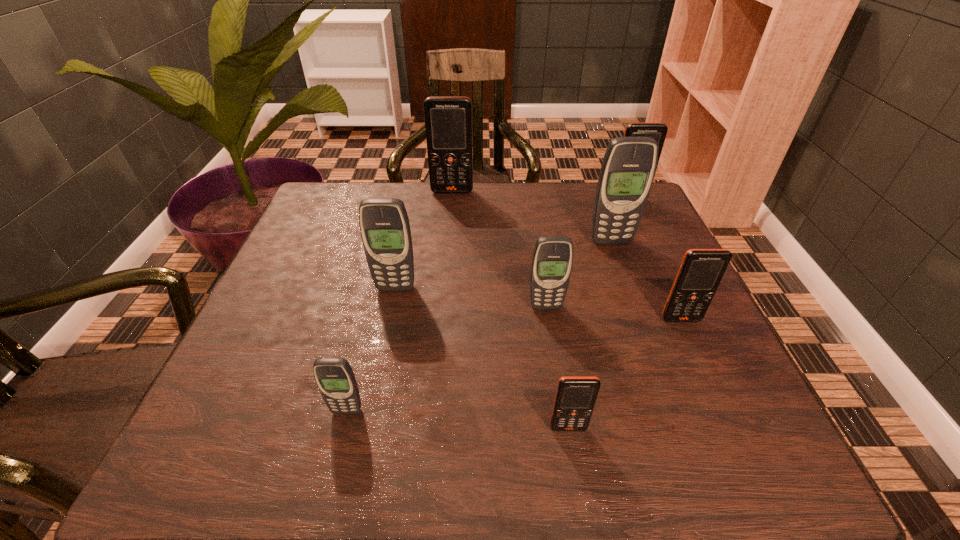
Locate an element on the screen. vacant space located on the screen of the second smallest gray cellular telephone is located at coordinates (557, 374).

Where is `vacant area situated 0.150m on the screen of the third nearest object`? This screenshot has height=540, width=960. vacant area situated 0.150m on the screen of the third nearest object is located at coordinates (711, 387).

Image resolution: width=960 pixels, height=540 pixels. I want to click on object that is at the near edge, so click(x=575, y=398).

This screenshot has height=540, width=960. In order to click on object present at the far right corner in this screenshot , I will do `click(657, 131)`.

Where is `free point at the far edge`? free point at the far edge is located at coordinates (458, 198).

Image resolution: width=960 pixels, height=540 pixels. I want to click on vacant region at the near edge, so click(x=559, y=436).

The width and height of the screenshot is (960, 540). Find the location of `vacant space at the left edge of the desktop`. vacant space at the left edge of the desktop is located at coordinates (323, 307).

Locate an element on the screen. free space at the right edge of the desktop is located at coordinates (653, 251).

What are the coordinates of `vacant position at the far left corner of the desktop` in the screenshot? It's located at pos(340,200).

Image resolution: width=960 pixels, height=540 pixels. What are the coordinates of `free spot between the third biggest orange cellular telephone and the nearest object` in the screenshot? It's located at (625, 374).